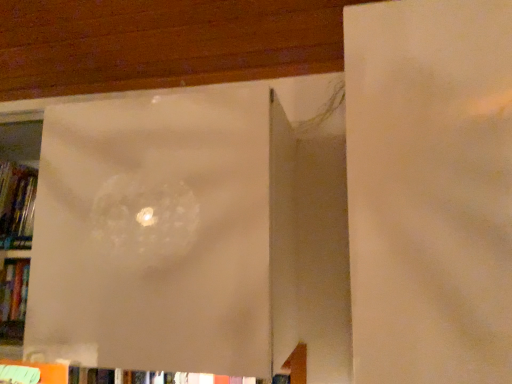
Question: From the image's perspective, is transparent plastic bag at center above or below hardcover book at left?

Choices:
 (A) below
 (B) above

Answer: (A)

Question: Is point pyautogui.click(x=232, y=148) closer or farther from the camera than point pyautogui.click(x=24, y=230)?

Choices:
 (A) closer
 (B) farther

Answer: (A)

Question: Do you think transparent plastic bag at center is within hardcover book at left, or outside of it?

Choices:
 (A) outside
 (B) inside

Answer: (A)

Question: In the image, is hardcover book at left positioned in front of or behind transparent plastic bag at center?

Choices:
 (A) behind
 (B) front

Answer: (A)

Question: Visually, is hardcover book at left positioned to the left or to the right of transparent plastic bag at center?

Choices:
 (A) left
 (B) right

Answer: (A)

Question: Is hardcover book at left wider or thinner than transparent plastic bag at center?

Choices:
 (A) wide
 (B) thin

Answer: (B)

Question: From a real-world perspective, is hardcover book at left above or below transparent plastic bag at center?

Choices:
 (A) above
 (B) below

Answer: (A)